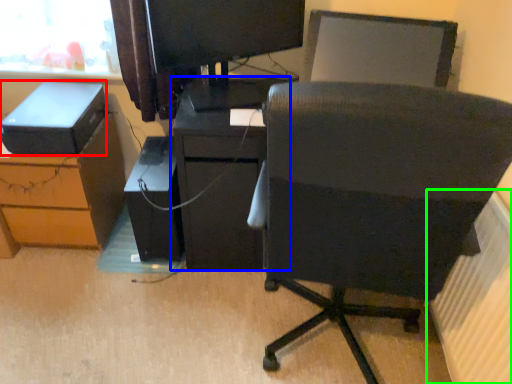
Question: Considering the real-world distances, which object is closest to storage box (highlighted by a red box)? furniture (highlighted by a blue box) or radiator (highlighted by a green box).

Choices:
 (A) furniture
 (B) radiator

Answer: (A)